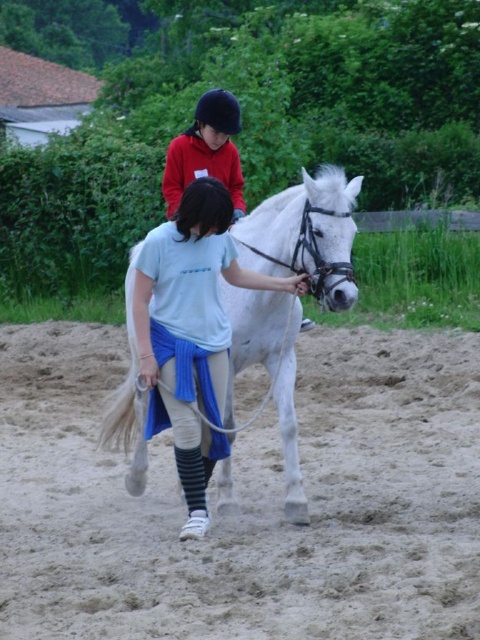
You are standing in the outdoor scene and want to know which object is closer to you. Based on the description, which one is lower in height between the sandy dirt field at lower center and the matte red jacket at upper center?

The sandy dirt field at lower center has a lesser height compared to the matte red jacket at upper center, so the sandy dirt field at lower center is lower in height and closer to you.

You are a photographer setting up a tripod in the sandy dirt field at lower center. You want to take a photo of the white glossy horse at center. Will the horse be visible in your shot if you aim the camera straight ahead?

Yes, the white glossy horse at center is above the sandy dirt field at lower center, so aiming the camera straight ahead will capture the horse in the shot.

You are standing at the point marked as point (247,499) in the image. What is the terrain like at that location?

The terrain at point (247,499) is a sandy dirt field at lower center.